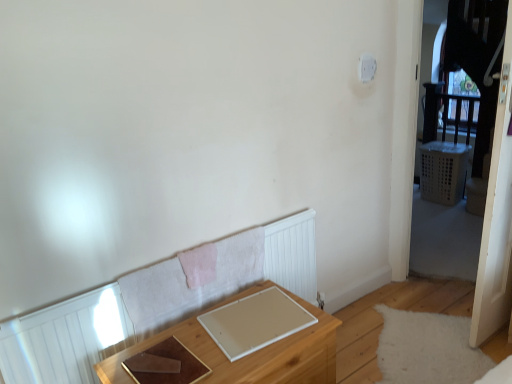
This screenshot has width=512, height=384. I want to click on free space above wooden table at lower center (from a real-world perspective), so click(218, 336).